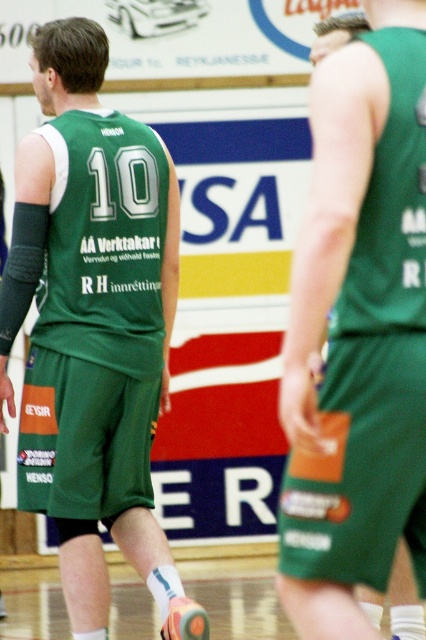
Based on the photo, you are a photographer positioned at the baseline of the basketball court. You see the green matte jersey at center and the green matte shorts at center. Which one is closer to the left side of the court?

The green matte jersey at center is closer to the left side of the court than the green matte shorts at center.

You are a sports equipment manager checking the sizes of the team uniforms. You notice both the green matte jersey at center and the green matte shorts at center. Which one has a larger size?

The green matte jersey at center has a larger size compared to the green matte shorts at center.

You are a photographer taking a picture of the basketball game. You notice the green matte jersey at center and the green matte shorts at center. Which one is closer to the camera?

The green matte jersey at center is closer to the camera than the green matte shorts at center because the shorts are positioned behind the jersey.